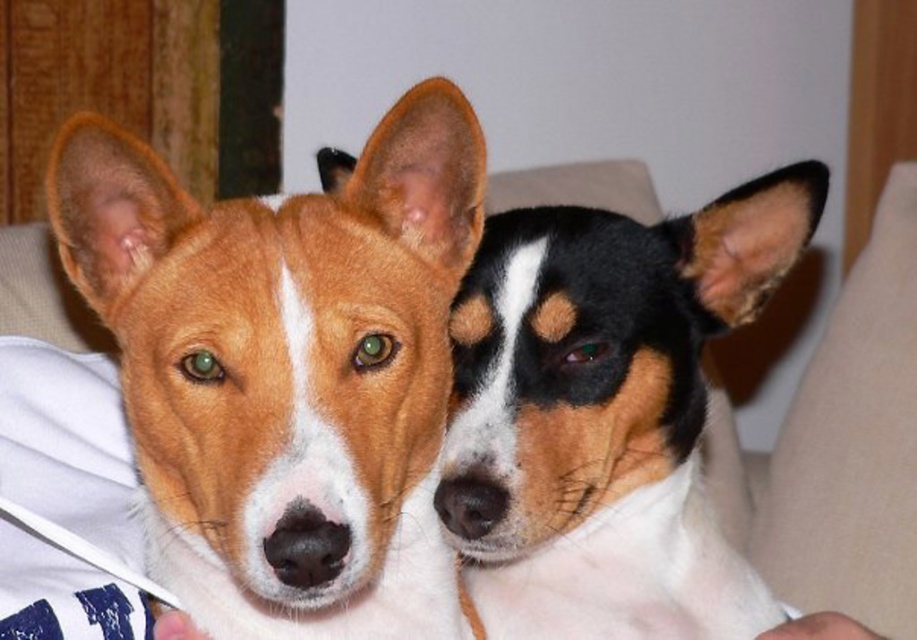
Who is positioned more to the right, brown fur dog at left or black and white fur at center?

Positioned to the right is black and white fur at center.

Describe the element at coordinates (286, 369) in the screenshot. I see `brown fur dog at left` at that location.

Measure the distance between point [218,388] and camera.

Point [218,388] is 24.90 inches away from camera.

Find the location of a particular element. Image resolution: width=917 pixels, height=640 pixels. brown fur dog at left is located at coordinates (286, 369).